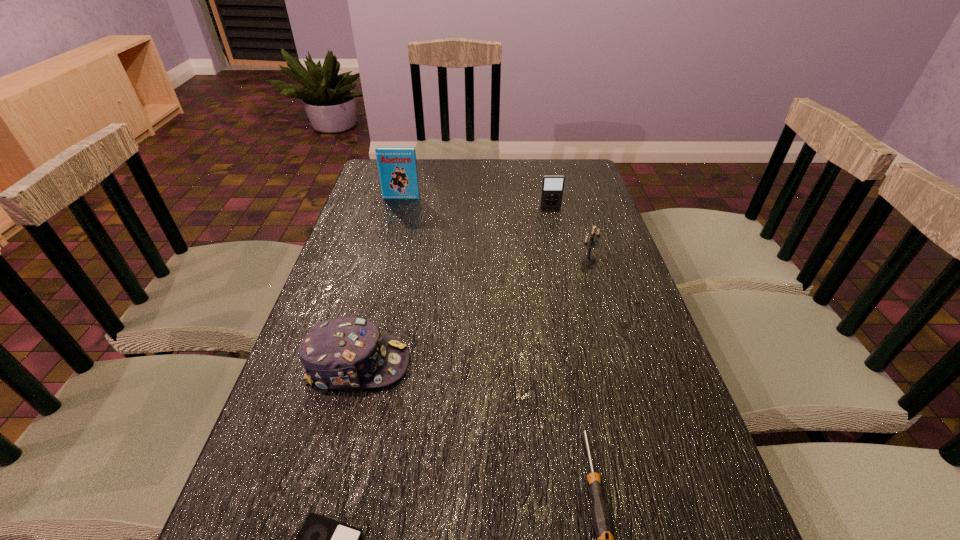
Image resolution: width=960 pixels, height=540 pixels. Identify the location of the tallest object. (397, 166).

The width and height of the screenshot is (960, 540). Identify the location of book. (397, 166).

Find the location of a particular element. the rightmost object is located at coordinates (591, 243).

At what (x,y) coordinates should I click in order to perform the action: click on the fourth nearest object. Please return your answer as a coordinate pair (x, y). The image size is (960, 540). Looking at the image, I should click on (591, 243).

At what (x,y) coordinates should I click in order to perform the action: click on the right iPod. Please return your answer as a coordinate pair (x, y). The width and height of the screenshot is (960, 540). Looking at the image, I should click on (552, 185).

Identify the location of the taller iPod. The width and height of the screenshot is (960, 540). 552,185.

The height and width of the screenshot is (540, 960). I want to click on headwear, so click(x=345, y=352).

You are a GUI agent. You are given a task and a screenshot of the screen. Output one action in this format:
    pyautogui.click(x=<x>, y=<y>)
    Task: Click on the blank space located 0.080m on the front cover of the tallest object
    
    Given the screenshot: What is the action you would take?
    pyautogui.click(x=397, y=212)

Identify the location of free spot located on the front of the rightmost object. (596, 287).

Image resolution: width=960 pixels, height=540 pixels. Find the location of `vacant space located on the front-facing side of the fifth nearest object`. vacant space located on the front-facing side of the fifth nearest object is located at coordinates (556, 229).